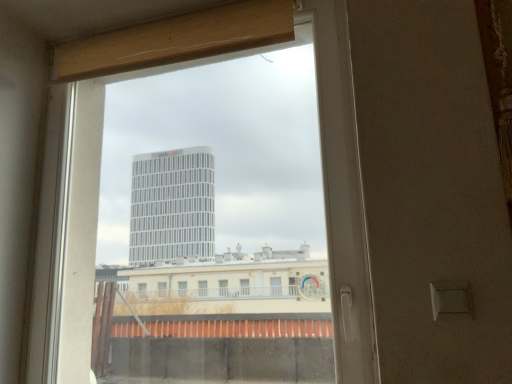
Measure the distance between point (338, 80) and camera.

A distance of 4.32 feet exists between point (338, 80) and camera.

The width and height of the screenshot is (512, 384). Find the location of `transparent glass window at center`. transparent glass window at center is located at coordinates pos(343,194).

What do you see at coordinates (343, 194) in the screenshot? This screenshot has width=512, height=384. I see `transparent glass window at center` at bounding box center [343, 194].

The height and width of the screenshot is (384, 512). In order to click on transparent glass window at center in this screenshot , I will do `click(343, 194)`.